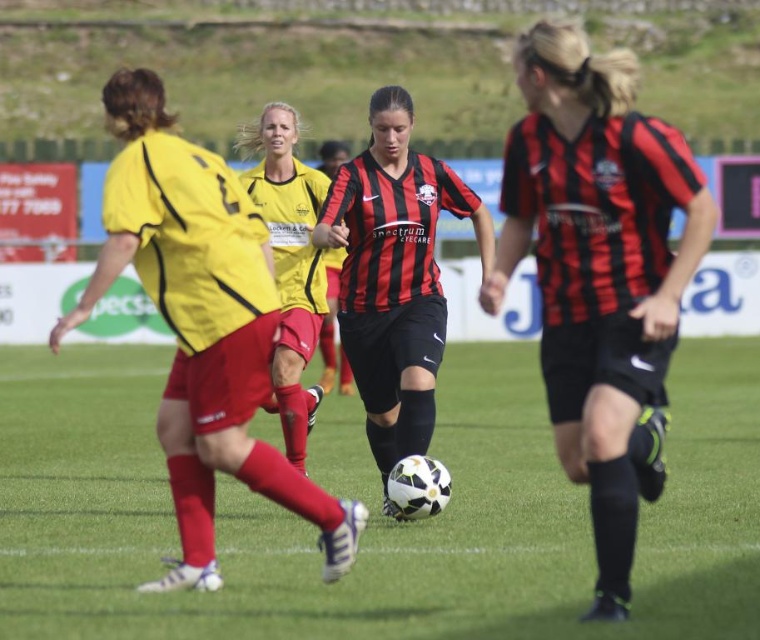
Consider the image. You are a soccer player positioned at the center of the field. You need to pass the ball to your teammate wearing matte black shorts at center. What are the coordinates where you should aim your pass?

The coordinates to aim the pass are at point (x=599, y=273), where the matte black shorts at center are located.